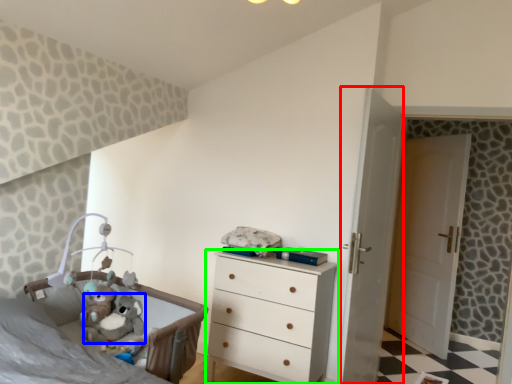
Question: Which object is positioned closest to screen door (highlighted by a red box)? Select from animal (highlighted by a blue box) and chest of drawers (highlighted by a green box).

Choices:
 (A) animal
 (B) chest of drawers

Answer: (B)